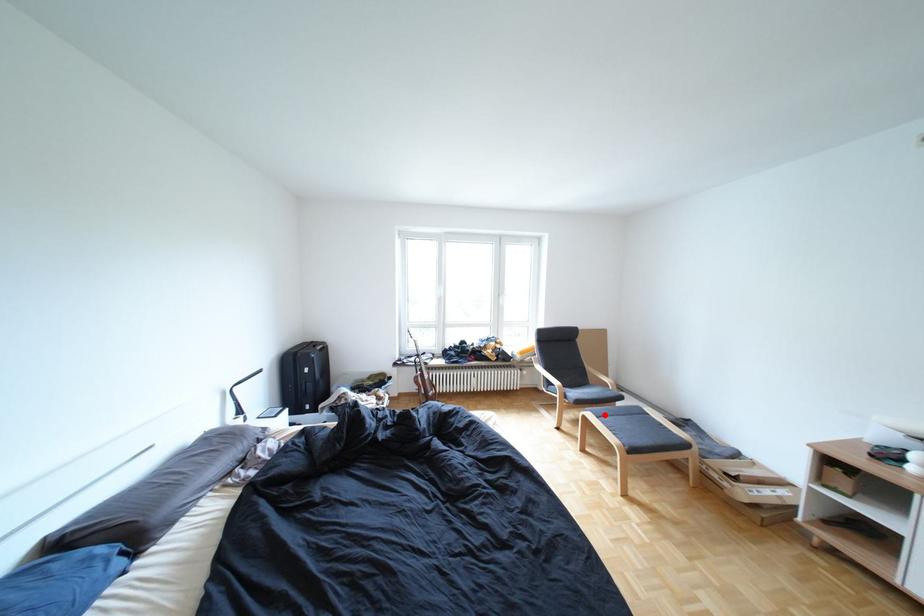
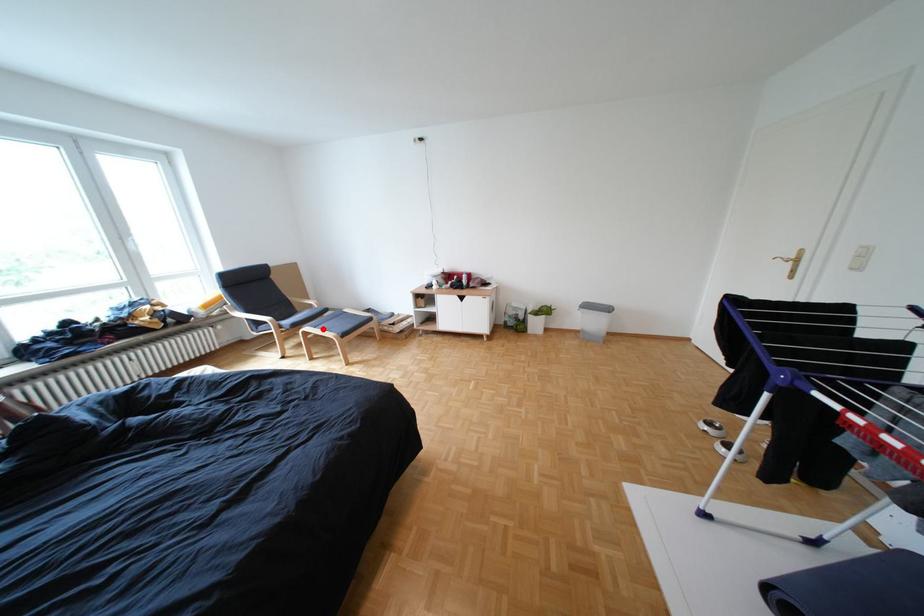
I am providing you with two images of the same scene from different viewpoints. A red point is marked on the first image and another point is marked on the second image. Are the points marked in image1 and image2 representing the same 3D position?

Yes